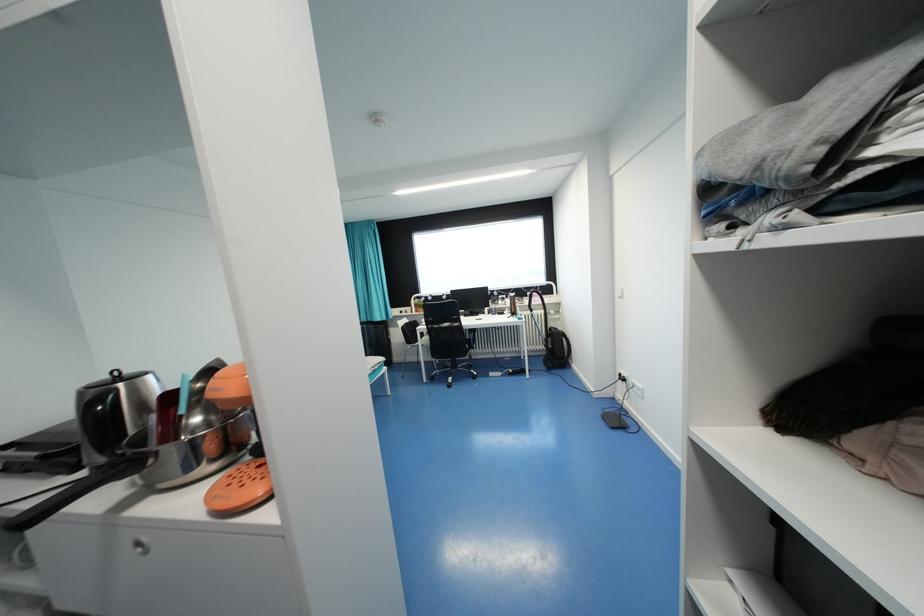
The height and width of the screenshot is (616, 924). Identify the location of stainless steel bowl. point(187,413).